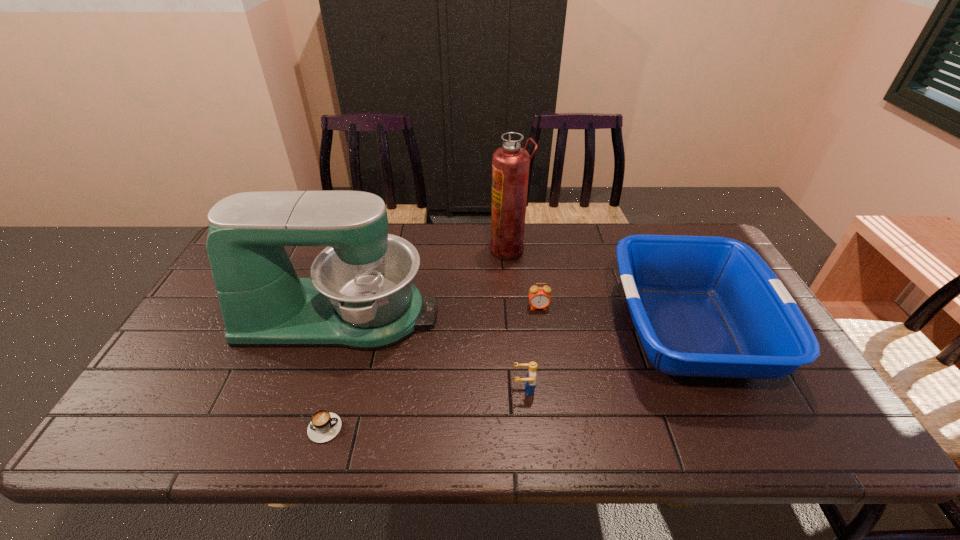
Where is `object that is at the left edge`? The image size is (960, 540). object that is at the left edge is located at coordinates (360, 295).

Where is `object positioned at the right edge`? Image resolution: width=960 pixels, height=540 pixels. object positioned at the right edge is located at coordinates (703, 306).

Identify the location of vacant position at the far edge of the desktop. (543, 259).

Locate an element on the screen. Image resolution: width=960 pixels, height=540 pixels. free space at the near left corner is located at coordinates (177, 428).

The width and height of the screenshot is (960, 540). I want to click on blank space at the near right corner of the desktop, so click(x=805, y=428).

Locate an element on the screen. The width and height of the screenshot is (960, 540). vacant area that lies between the Lego and the fire extinguisher is located at coordinates (516, 319).

I want to click on blank region between the alarm clock and the rightmost object, so click(613, 319).

Locate an element on the screen. The width and height of the screenshot is (960, 540). empty space between the cappuccino and the Lego is located at coordinates (421, 409).

Identify the location of vacant area that lies between the Lego and the tray. coord(606,360).

Where is `empty location between the fire extinguisher and the tray`? The width and height of the screenshot is (960, 540). empty location between the fire extinguisher and the tray is located at coordinates (598, 289).